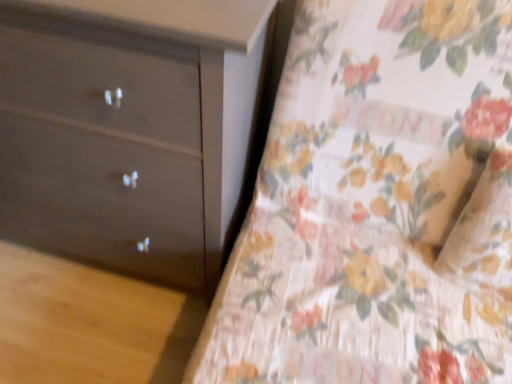
The width and height of the screenshot is (512, 384). Describe the element at coordinates (125, 138) in the screenshot. I see `matte dark brown dresser at left` at that location.

Locate an element on the screen. matte dark brown dresser at left is located at coordinates [125, 138].

This screenshot has height=384, width=512. What do you see at coordinates (377, 205) in the screenshot? I see `floral fabric bedspread at center` at bounding box center [377, 205].

The width and height of the screenshot is (512, 384). I want to click on floral fabric bedspread at center, so click(377, 205).

Find the location of `matte dark brown dresser at left`. matte dark brown dresser at left is located at coordinates (125, 138).

Is floral fabric bedspread at center to the left of matte dark brown dresser at left from the viewer's perspective?

Incorrect, floral fabric bedspread at center is not on the left side of matte dark brown dresser at left.

In the image, is floral fabric bedspread at center positioned in front of or behind matte dark brown dresser at left?

In the image, floral fabric bedspread at center appears in front of matte dark brown dresser at left.

Is point (383, 382) positioned behind point (153, 227)?

No, it is not.

From the image's perspective, which is below, floral fabric bedspread at center or matte dark brown dresser at left?

From the image's view, floral fabric bedspread at center is below.

From a real-world perspective, which object stands above the other?

floral fabric bedspread at center is physically above.

Is floral fabric bedspread at center wider or thinner than matte dark brown dresser at left?

In the image, floral fabric bedspread at center appears to be wider than matte dark brown dresser at left.

Considering the relative sizes of floral fabric bedspread at center and matte dark brown dresser at left in the image provided, is floral fabric bedspread at center shorter than matte dark brown dresser at left?

Yes, floral fabric bedspread at center is shorter than matte dark brown dresser at left.

Looking at this image, does floral fabric bedspread at center have a larger size compared to matte dark brown dresser at left?

Yes.

Do you think floral fabric bedspread at center is within matte dark brown dresser at left, or outside of it?

The correct answer is: outside.

Are floral fabric bedspread at center and matte dark brown dresser at left located far from each other?

No.

Does floral fabric bedspread at center turn towards matte dark brown dresser at left?

No, floral fabric bedspread at center is not aimed at matte dark brown dresser at left.

From the picture: What's the angular difference between floral fabric bedspread at center and matte dark brown dresser at left's facing directions?

1.03 degrees.

Where is `chest of drawers behind the floral fabric bedspread at center`? Image resolution: width=512 pixels, height=384 pixels. chest of drawers behind the floral fabric bedspread at center is located at coordinates (125, 138).

Considering the relative positions of matte dark brown dresser at left and floral fabric bedspread at center in the image provided, is matte dark brown dresser at left to the right of floral fabric bedspread at center from the viewer's perspective?

Incorrect, matte dark brown dresser at left is not on the right side of floral fabric bedspread at center.

In the image, is matte dark brown dresser at left positioned in front of or behind floral fabric bedspread at center?

Clearly, matte dark brown dresser at left is behind floral fabric bedspread at center.

Which is farther, [96,178] or [256,225]?

The point [256,225] is more distant.

From the image's perspective, who appears lower, matte dark brown dresser at left or floral fabric bedspread at center?

Answer: floral fabric bedspread at center is shown below in the image.

From a real-world perspective, which object rests below the other?

From a 3D spatial view, matte dark brown dresser at left is below.

Is matte dark brown dresser at left wider than floral fabric bedspread at center?

No.

Based on the photo, is matte dark brown dresser at left taller or shorter than floral fabric bedspread at center?

matte dark brown dresser at left is taller than floral fabric bedspread at center.

Is matte dark brown dresser at left smaller than floral fabric bedspread at center?

Yes.

Could floral fabric bedspread at center be considered to be inside matte dark brown dresser at left?

No, floral fabric bedspread at center is not a part of matte dark brown dresser at left.

Is matte dark brown dresser at left beside floral fabric bedspread at center?

No.

Could you tell me if matte dark brown dresser at left is facing floral fabric bedspread at center?

No, matte dark brown dresser at left is not turned towards floral fabric bedspread at center.

How many degrees apart are the facing directions of matte dark brown dresser at left and floral fabric bedspread at center?

There is a 1.03-degree angle between the facing directions of matte dark brown dresser at left and floral fabric bedspread at center.

Find the location of a particular element. Image resolution: width=512 pixels, height=384 pixels. chest of drawers below the floral fabric bedspread at center (from a real-world perspective) is located at coordinates (125, 138).

Locate an element on the screen. chest of drawers on the left of floral fabric bedspread at center is located at coordinates (125, 138).

Find the location of `sheet in front of the matte dark brown dresser at left`. sheet in front of the matte dark brown dresser at left is located at coordinates (377, 205).